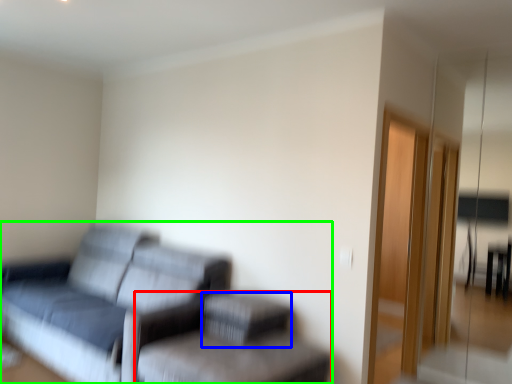
Question: Estimate the real-world distances between objects in this image. Which object is closer to swivel chair (highlighted by a red box), footrest (highlighted by a blue box) or studio couch (highlighted by a green box)?

Choices:
 (A) footrest
 (B) studio couch

Answer: (A)